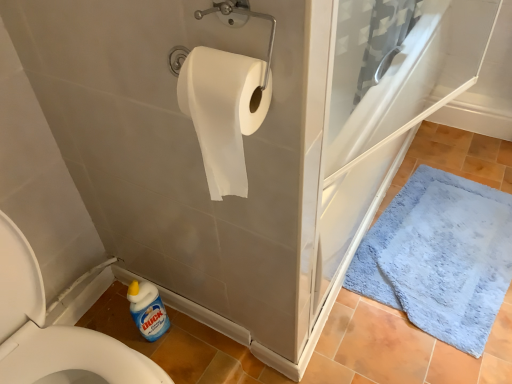
Question: From a real-world perspective, is white matte toilet paper at upper center physically above white paper towel at left?

Choices:
 (A) yes
 (B) no

Answer: (A)

Question: Can you confirm if white matte toilet paper at upper center is smaller than white paper towel at left?

Choices:
 (A) yes
 (B) no

Answer: (A)

Question: Is white matte toilet paper at upper center completely or partially outside of white paper towel at left?

Choices:
 (A) yes
 (B) no

Answer: (A)

Question: From a real-world perspective, is white matte toilet paper at upper center located beneath white paper towel at left?

Choices:
 (A) yes
 (B) no

Answer: (B)

Question: Considering the relative sizes of white matte toilet paper at upper center and white paper towel at left in the image provided, is white matte toilet paper at upper center shorter than white paper towel at left?

Choices:
 (A) no
 (B) yes

Answer: (B)

Question: Is blue plush bath mat at lower right to the left or to the right of white matte toilet paper at upper center in the image?

Choices:
 (A) right
 (B) left

Answer: (A)

Question: From the image's perspective, is blue plush bath mat at lower right above or below white matte toilet paper at upper center?

Choices:
 (A) below
 (B) above

Answer: (A)

Question: Relative to white matte toilet paper at upper center, is blue plush bath mat at lower right in front or behind?

Choices:
 (A) front
 (B) behind

Answer: (B)

Question: Based on their sizes in the image, would you say blue plush bath mat at lower right is bigger or smaller than white matte toilet paper at upper center?

Choices:
 (A) small
 (B) big

Answer: (B)

Question: Is white matte toilet paper at upper center in front of or behind white paper towel at left in the image?

Choices:
 (A) behind
 (B) front

Answer: (A)

Question: Is white matte toilet paper at upper center spatially inside white paper towel at left, or outside of it?

Choices:
 (A) inside
 (B) outside

Answer: (B)

Question: Is white matte toilet paper at upper center bigger or smaller than white paper towel at left?

Choices:
 (A) big
 (B) small

Answer: (B)

Question: Is white matte toilet paper at upper center to the left or to the right of white paper towel at left in the image?

Choices:
 (A) right
 (B) left

Answer: (A)

Question: From the image's perspective, is white matte toilet paper at upper center located above or below blue plastic bottle at lower left?

Choices:
 (A) above
 (B) below

Answer: (A)

Question: Is white matte toilet paper at upper center in front of or behind blue plastic bottle at lower left in the image?

Choices:
 (A) front
 (B) behind

Answer: (A)